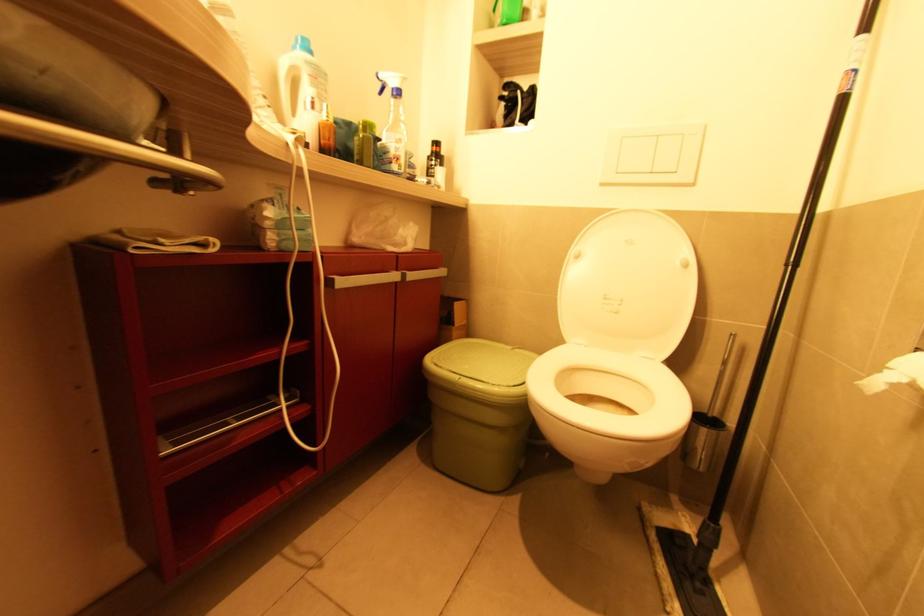
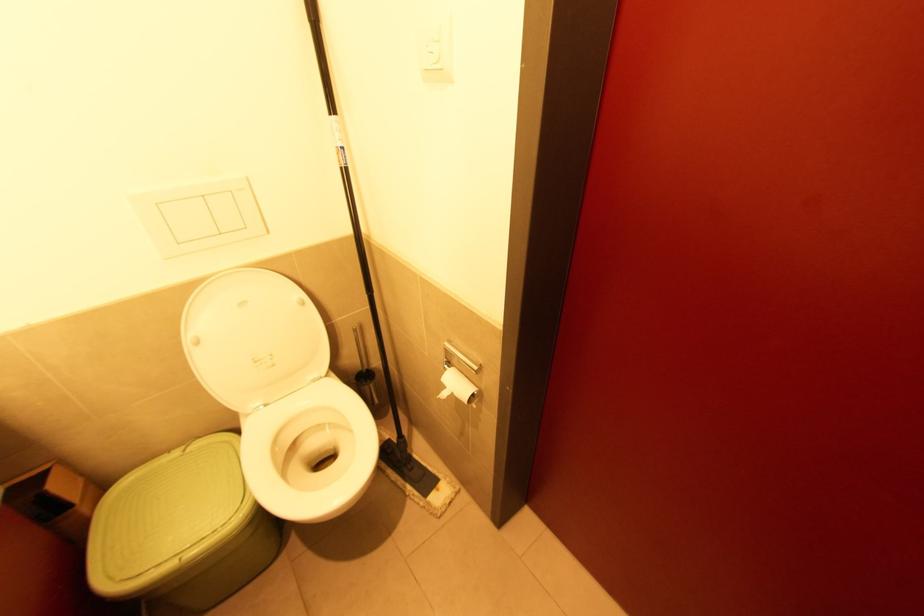
In the second image, find the point that corresponds to point (652, 172) in the first image.

(224, 235)